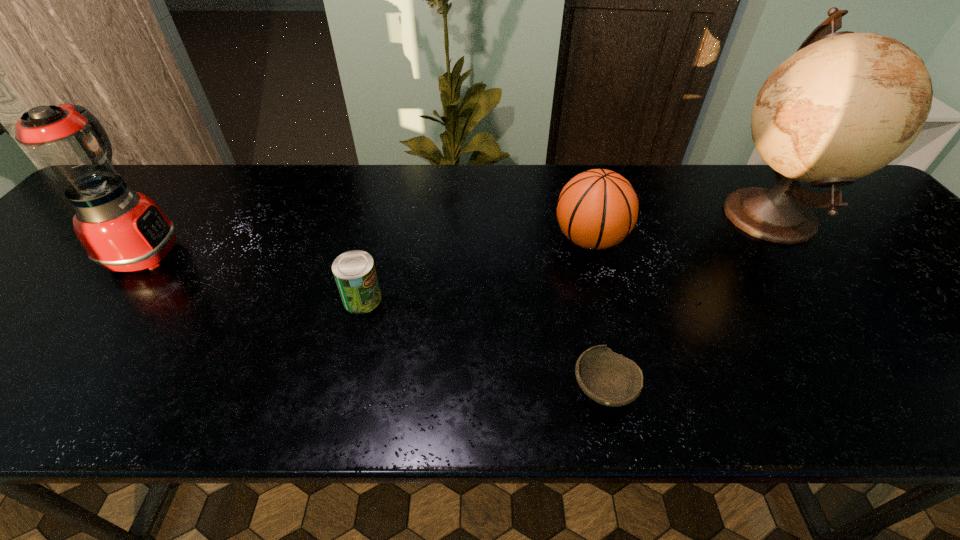
Identify the location of globe. This screenshot has height=540, width=960. (845, 105).

This screenshot has height=540, width=960. I want to click on the rightmost object, so click(x=845, y=105).

This screenshot has height=540, width=960. I want to click on food processor, so click(122, 230).

The height and width of the screenshot is (540, 960). What are the coordinates of `the second tallest object` in the screenshot? It's located at (122, 230).

This screenshot has height=540, width=960. I want to click on the third tallest object, so click(x=597, y=209).

This screenshot has width=960, height=540. Find the location of `the fourth tallest object`. the fourth tallest object is located at coordinates (354, 271).

Image resolution: width=960 pixels, height=540 pixels. I want to click on the second nearest object, so click(354, 271).

Locate an element on the screen. Image resolution: width=960 pixels, height=540 pixels. the nearest object is located at coordinates (608, 378).

Locate an element on the screen. the shortest object is located at coordinates (608, 378).

Locate an element on the screen. This screenshot has width=960, height=540. vacant position located on the front-facing side of the rightmost object is located at coordinates (595, 214).